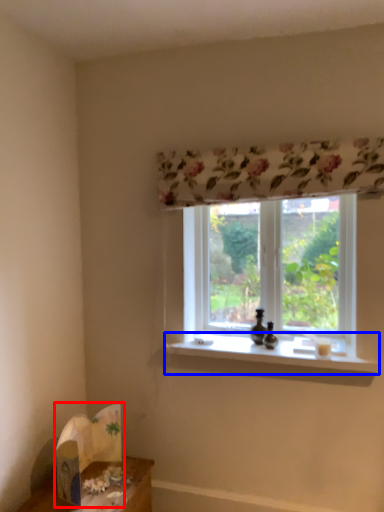
Question: Which object appears farthest to the camera in this image, cardboard box (highlighted by a red box) or window sill (highlighted by a blue box)?

Choices:
 (A) cardboard box
 (B) window sill

Answer: (B)